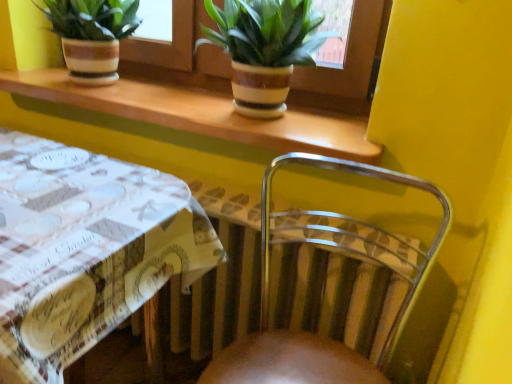
The image size is (512, 384). What are the coordinates of `free region under matte striped pot at upper left, positioned as the second houseplant in right-to-left order (from a real-world perspective)` in the screenshot? It's located at (102, 83).